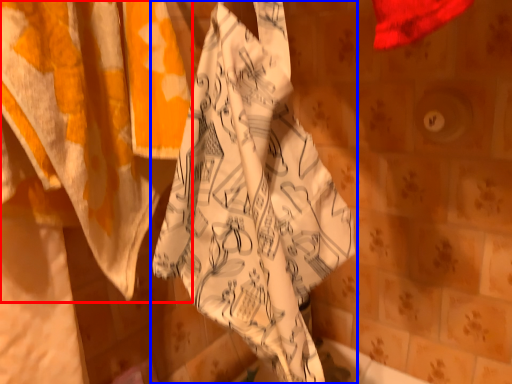
Question: Which object is further to the camera taking this photo, curtain (highlighted by a red box) or towel (highlighted by a blue box)?

Choices:
 (A) curtain
 (B) towel

Answer: (B)